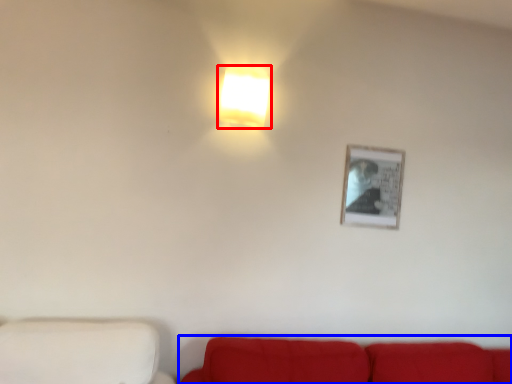
Question: Which object is further to the camera taking this photo, lamp (highlighted by a red box) or studio couch (highlighted by a blue box)?

Choices:
 (A) lamp
 (B) studio couch

Answer: (A)